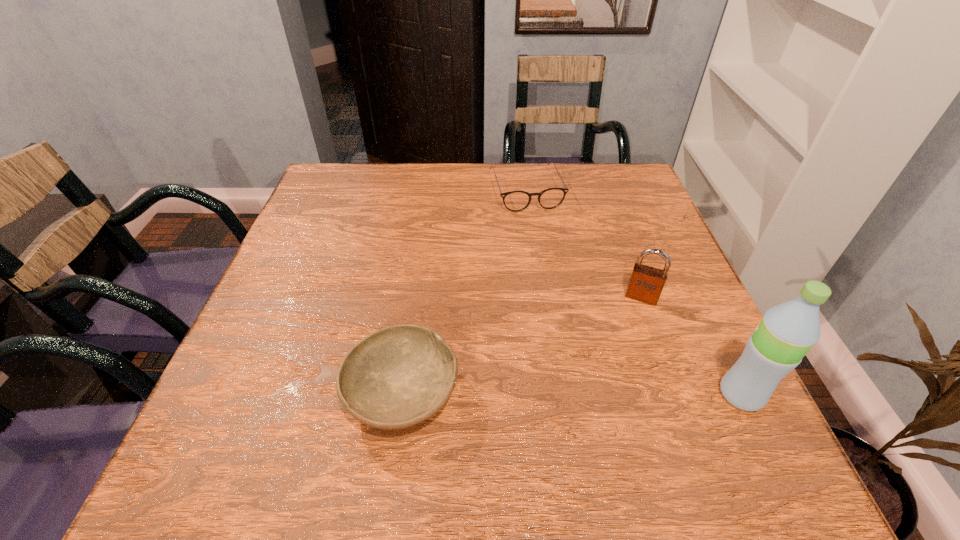
Find the location of a particular element. The width and height of the screenshot is (960, 540). padlock present at the right edge is located at coordinates (646, 283).

You are a GUI agent. You are given a task and a screenshot of the screen. Output one action in this format:
    pyautogui.click(x=<x>, y=<y>)
    Task: Click on the object situated at the near right corner
    Image resolution: width=960 pixels, height=540 pixels.
    Given the screenshot: What is the action you would take?
    pyautogui.click(x=787, y=331)

Find the location of a particular element. vacant position at the far edge of the desktop is located at coordinates (529, 170).

The image size is (960, 540). In order to click on vacant space at the near edge of the desktop in this screenshot , I will do `click(474, 421)`.

In the image, there is a desktop. At what (x,y) coordinates should I click in order to perform the action: click on vacant space at the left edge. Please return your answer as a coordinate pair (x, y). Looking at the image, I should click on (317, 325).

Where is `vacant space at the right edge of the desktop`? The image size is (960, 540). vacant space at the right edge of the desktop is located at coordinates (647, 359).

This screenshot has height=540, width=960. In the image, there is a desktop. What are the coordinates of `free region at the far left corner` in the screenshot? It's located at (331, 184).

In the image, there is a desktop. Where is `vacant space at the near left corner`? The height and width of the screenshot is (540, 960). vacant space at the near left corner is located at coordinates (242, 408).

Locate an element on the screen. The width and height of the screenshot is (960, 540). free space at the far right corner is located at coordinates (602, 195).

I want to click on vacant area between the second object from right to left and the shortest object, so pos(584,244).